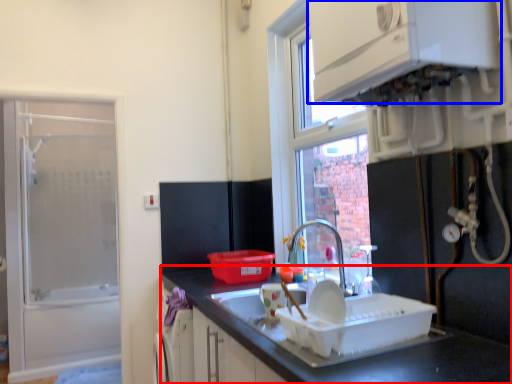
Question: Which point is further to the camera, countertop (highlighted by a red box) or cabinetry (highlighted by a blue box)?

Choices:
 (A) countertop
 (B) cabinetry

Answer: (B)